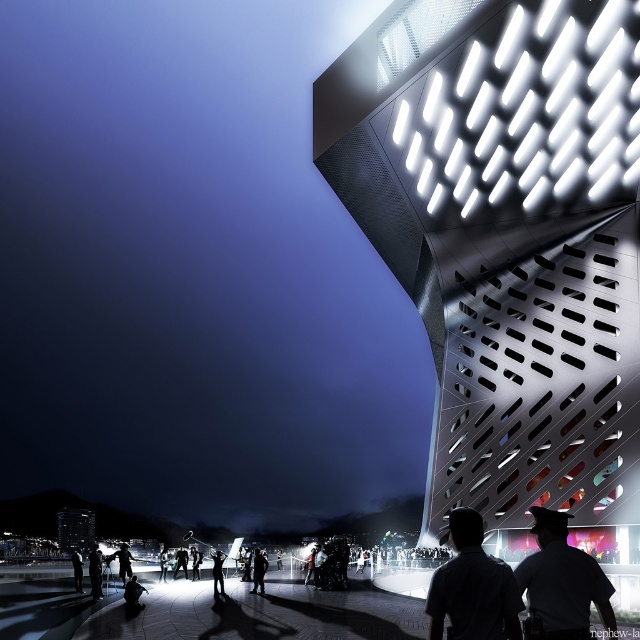
You are a photographer standing in the scene. You want to capture a photo where both the metallic perforated facade at upper right and the dark gray fabric jacket at lower left are clearly visible. Considering their widths, which object should you zoom in on to ensure both fit in the frame?

The metallic perforated facade at upper right has a lesser width compared to dark gray fabric jacket at lower left. To ensure both fit in the frame, you should zoom in on the wider object, which is the dark gray fabric jacket at lower left, allowing the narrower metallic perforated facade at upper right to also be captured clearly.

You are standing at the dark gray fabric jacket at lower left and want to take a photo of the metallic perforated facade at upper right. Considering the distance between them, is it possible to capture the entire facade in a single shot without moving your position?

The metallic perforated facade at upper right and dark gray fabric jacket at lower left are 32.81 meters apart. Since the distance is significant, it is possible to capture the entire facade in a single shot using a wide angle lens, provided the camera has sufficient zoom capability to encompass the facade from that distance without moving your position.